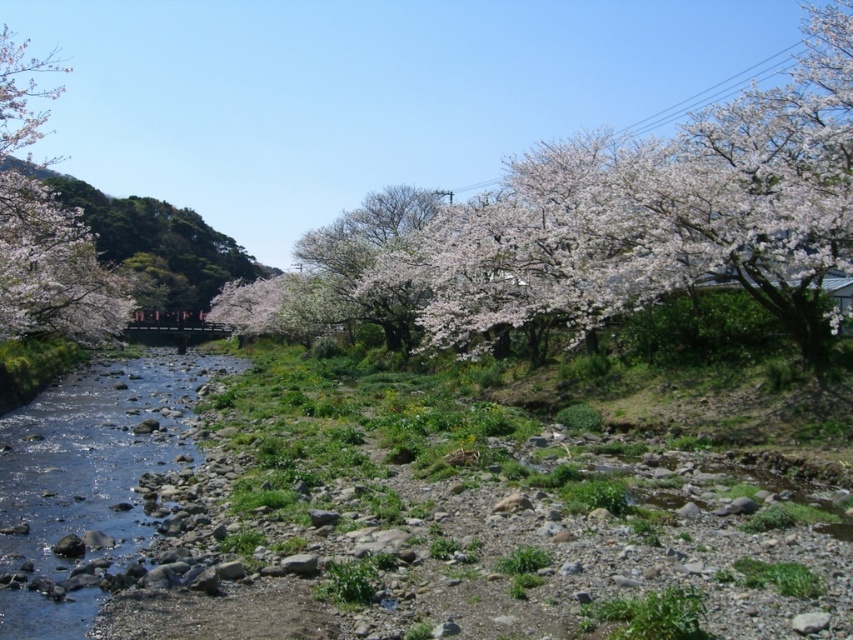
You are standing at the lower edge of the image and want to walk towards the white blossoming tree at upper center. According to the coordinates given, in which direction should you move first?

The white blossoming tree at upper center is located at coordinates 0.334 on the x axis and 0.774 on the y axis. Since you are at the lower edge, you should move upward first to reach it.

You are a hiker who wants to cross the river at the location shown in the image. You have a 40 meter long rope. You see the clear water at river left and the white blossoming tree at left. Can you use the rope to safely cross the river between these two points?

Answer: The clear water at river left is 41.59 meters from the white blossoming tree at left. Since the rope is only 40 meters long, it is not long enough to span the distance between the clear water at river left and the white blossoming tree at left. Therefore, you cannot safely cross using this rope.